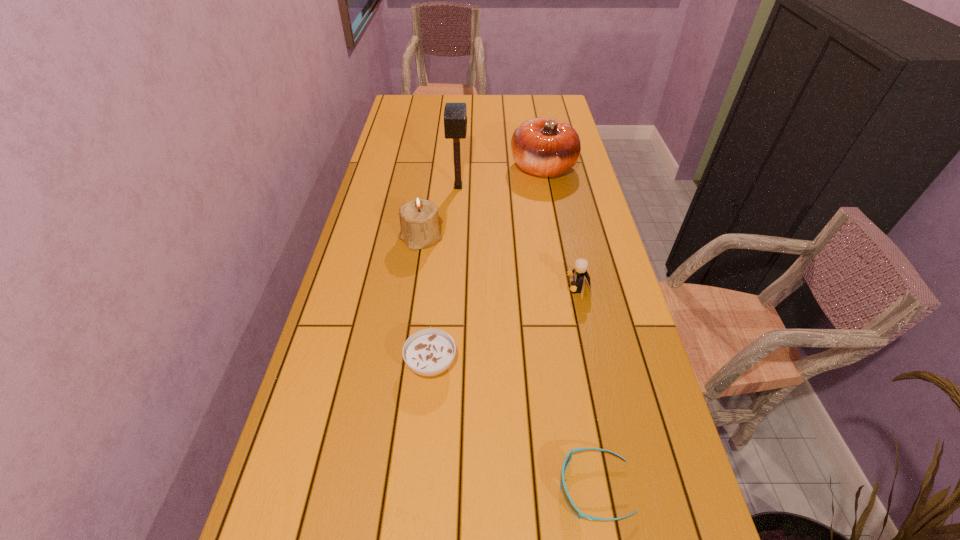
Locate an element on the screen. Image resolution: width=960 pixels, height=540 pixels. blank area in the image that satisfies the following two spatial constraints: 1. on the front side of the soup bowl; 2. on the left side of the third farthest object is located at coordinates (402, 363).

This screenshot has width=960, height=540. Find the location of `vacant space that satisfies the following two spatial constraints: 1. on the back side of the pumpkin; 2. on the right side of the tallest object`. vacant space that satisfies the following two spatial constraints: 1. on the back side of the pumpkin; 2. on the right side of the tallest object is located at coordinates (460, 168).